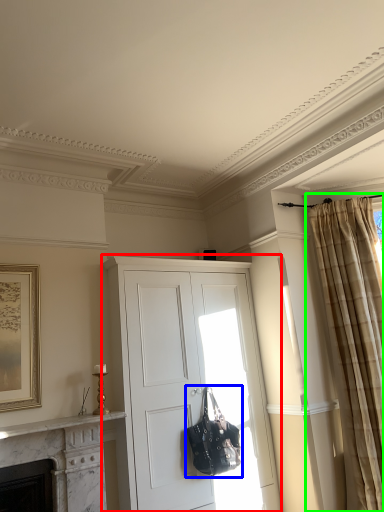
Question: Which object is the farthest from cabinetry (highlighted by a red box)? Choose among these: handbag (highlighted by a blue box) or curtain (highlighted by a green box).

Choices:
 (A) handbag
 (B) curtain

Answer: (B)